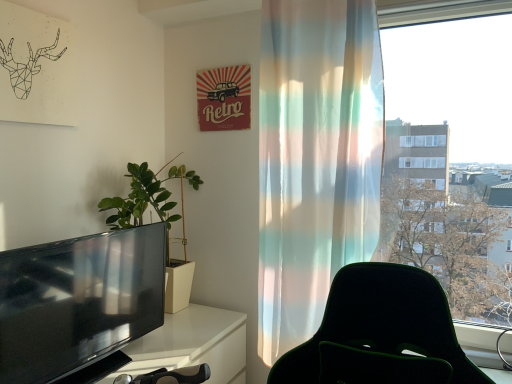
Question: Is translucent fabric curtain at right at the left side of green matte plant at left?

Choices:
 (A) no
 (B) yes

Answer: (A)

Question: Does translucent fabric curtain at right have a smaller size compared to green matte plant at left?

Choices:
 (A) yes
 (B) no

Answer: (B)

Question: Could you tell me if translucent fabric curtain at right is facing green matte plant at left?

Choices:
 (A) no
 (B) yes

Answer: (A)

Question: Considering the relative sizes of translucent fabric curtain at right and green matte plant at left in the image provided, is translucent fabric curtain at right thinner than green matte plant at left?

Choices:
 (A) no
 (B) yes

Answer: (B)

Question: Is the depth of translucent fabric curtain at right less than that of green matte plant at left?

Choices:
 (A) no
 (B) yes

Answer: (B)

Question: From a real-world perspective, is translucent fabric curtain at right under green matte plant at left?

Choices:
 (A) yes
 (B) no

Answer: (B)

Question: Is translucent fabric curtain at right at the back of black glossy television at left?

Choices:
 (A) no
 (B) yes

Answer: (A)

Question: Can you confirm if black glossy television at left is thinner than translucent fabric curtain at right?

Choices:
 (A) no
 (B) yes

Answer: (B)

Question: Does black glossy television at left have a greater width compared to translucent fabric curtain at right?

Choices:
 (A) yes
 (B) no

Answer: (B)

Question: From the image's perspective, is black glossy television at left below translucent fabric curtain at right?

Choices:
 (A) yes
 (B) no

Answer: (A)

Question: From a real-world perspective, does black glossy television at left stand above translucent fabric curtain at right?

Choices:
 (A) yes
 (B) no

Answer: (B)

Question: Considering the relative positions of black glossy television at left and translucent fabric curtain at right in the image provided, is black glossy television at left behind translucent fabric curtain at right?

Choices:
 (A) no
 (B) yes

Answer: (A)

Question: From a real-world perspective, is translucent fabric curtain at right on black glossy television at left?

Choices:
 (A) no
 (B) yes

Answer: (B)